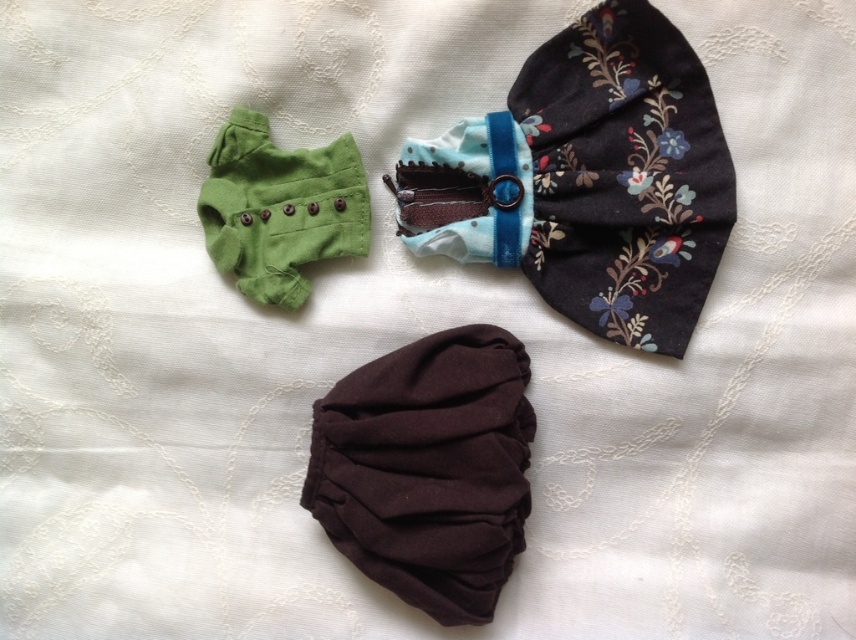
Question: Does brown cotton pants at center appear under green cotton pants at upper left?

Choices:
 (A) yes
 (B) no

Answer: (A)

Question: Where is brown cotton pants at center located in relation to green cotton pants at upper left in the image?

Choices:
 (A) above
 (B) below

Answer: (B)

Question: Which point appears closest to the camera in this image?

Choices:
 (A) (236, 124)
 (B) (646, 220)

Answer: (B)

Question: Where is floral fabric bow tie at upper center located in relation to green cotton pants at upper left in the image?

Choices:
 (A) below
 (B) above

Answer: (A)

Question: Which point is farther to the camera?

Choices:
 (A) (311, 497)
 (B) (503, 172)

Answer: (B)

Question: Which object is positioned closest to the brown cotton pants at center?

Choices:
 (A) floral fabric bow tie at upper center
 (B) green cotton pants at upper left

Answer: (A)